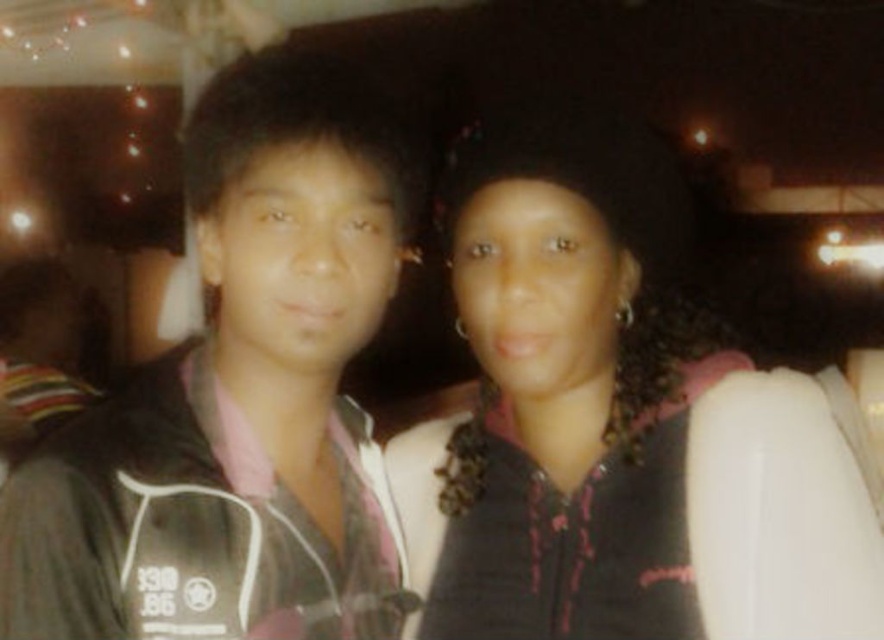
Question: Can you confirm if black matte jacket at center is positioned to the right of black matte jacket at left?

Choices:
 (A) yes
 (B) no

Answer: (A)

Question: Which object is closer to the camera taking this photo?

Choices:
 (A) black matte jacket at center
 (B) black matte jacket at left

Answer: (B)

Question: Which point is farther to the camera?

Choices:
 (A) black matte jacket at left
 (B) black matte jacket at center

Answer: (B)

Question: Does black matte jacket at center have a lesser width compared to black matte jacket at left?

Choices:
 (A) no
 (B) yes

Answer: (A)

Question: Is black matte jacket at center smaller than black matte jacket at left?

Choices:
 (A) yes
 (B) no

Answer: (B)